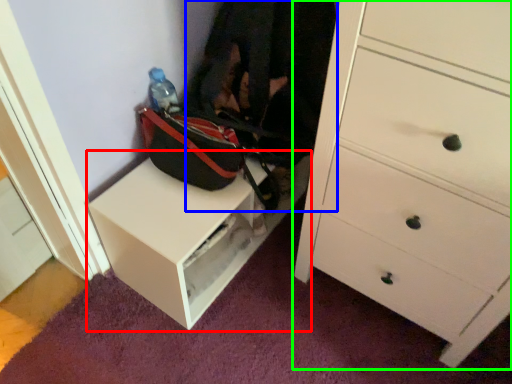
Question: Estimate the real-world distances between objects in this image. Which object is closer to table (highlighted by a red box), clothing (highlighted by a blue box) or chest of drawers (highlighted by a green box)?

Choices:
 (A) clothing
 (B) chest of drawers

Answer: (A)